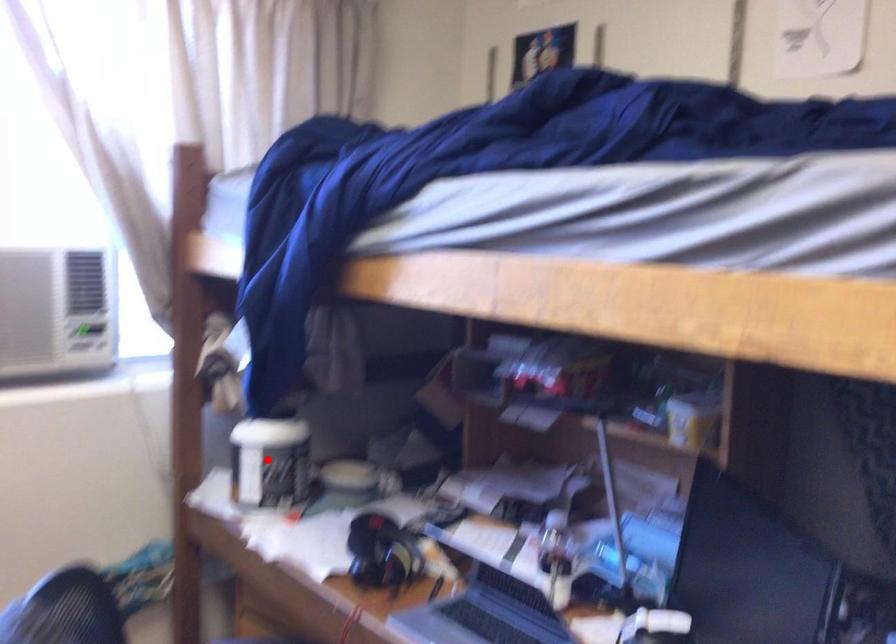
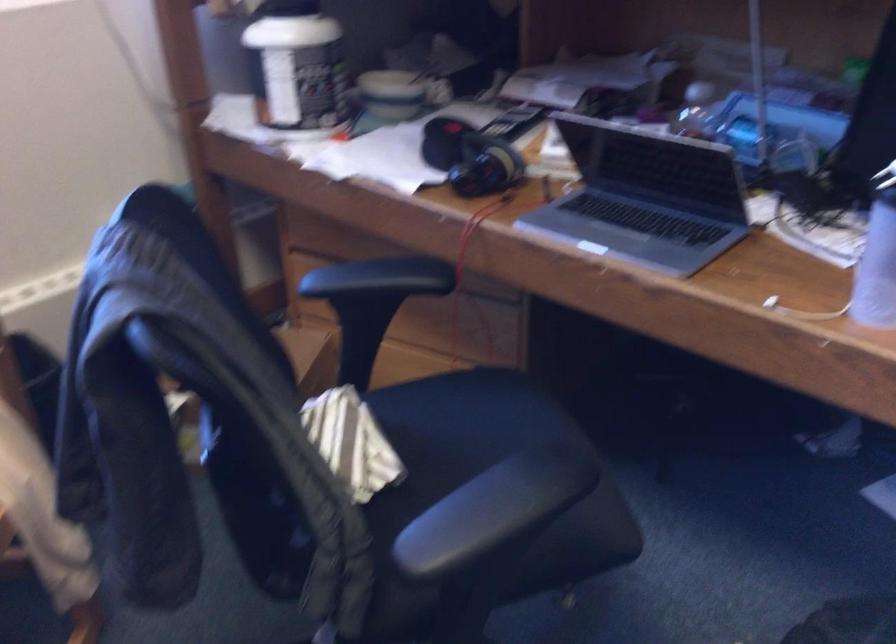
Question: I am providing you with two images of the same scene from different viewpoints. Given a red point in image1, look at the same physical point in image2. Is it:

Choices:
 (A) Closer to the viewpoint
 (B) Farther from the viewpoint

Answer: (A)